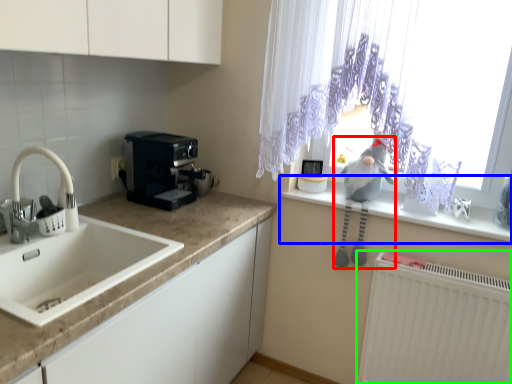
Question: Estimate the real-world distances between objects in this image. Which object is closer to animal (highlighted by a red box), window sill (highlighted by a blue box) or radiator (highlighted by a green box)?

Choices:
 (A) window sill
 (B) radiator

Answer: (A)